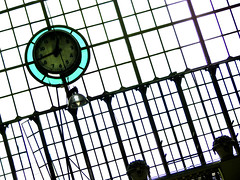
Identify the location of clock hands. (46, 55), (61, 55).